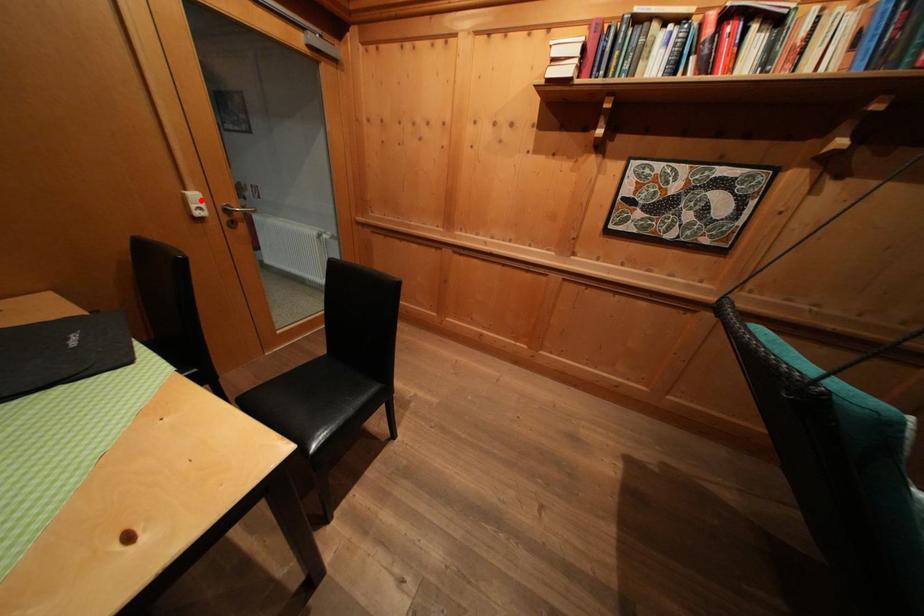
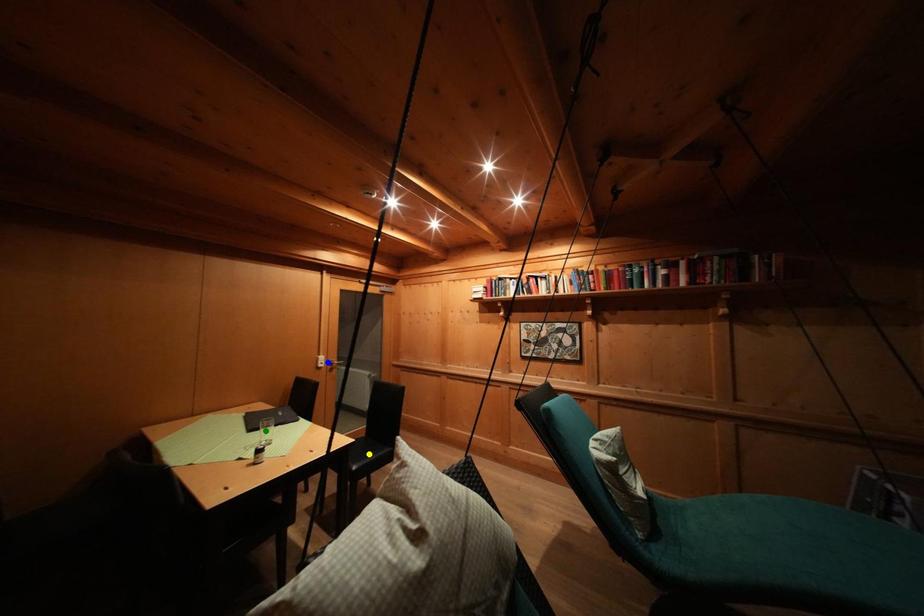
Question: I am providing you with two images of the same scene from different viewpoints. A red point is marked on the first image. You are given multiple points on the second image. Which mark in image 2 goes with the point in image 1?

Choices:
 (A) yellow point
 (B) blue point
 (C) green point

Answer: (B)